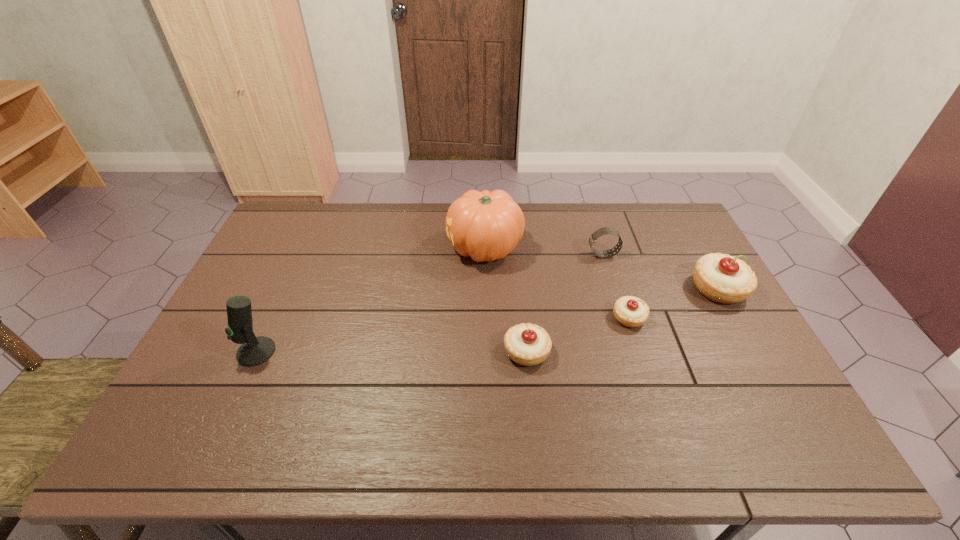
Locate an element on the screen. object present at the left edge is located at coordinates (254, 351).

Find the location of a particular element. This screenshot has height=540, width=960. object present at the right edge is located at coordinates (722, 278).

In the image, there is a desktop. Identify the location of vacant space at the far edge. The image size is (960, 540). (399, 208).

Locate an element on the screen. The width and height of the screenshot is (960, 540). free location at the near edge is located at coordinates (496, 415).

At what (x,y) coordinates should I click in order to perform the action: click on vacant space at the left edge of the desktop. Please return your answer as a coordinate pair (x, y). The image size is (960, 540). Looking at the image, I should click on (230, 348).

The image size is (960, 540). In order to click on vacant space at the far left corner of the desktop in this screenshot , I will do `click(276, 234)`.

Find the location of a particular element. The image size is (960, 540). vacant area at the near left corner is located at coordinates (245, 390).

The image size is (960, 540). In order to click on free space at the near right corner in this screenshot , I will do `click(742, 388)`.

Find the location of a particular element. This screenshot has height=540, width=960. free space that is in between the pumpkin and the microphone is located at coordinates (371, 300).

Where is `free spot between the watch and the nearest pastry`? free spot between the watch and the nearest pastry is located at coordinates (564, 303).